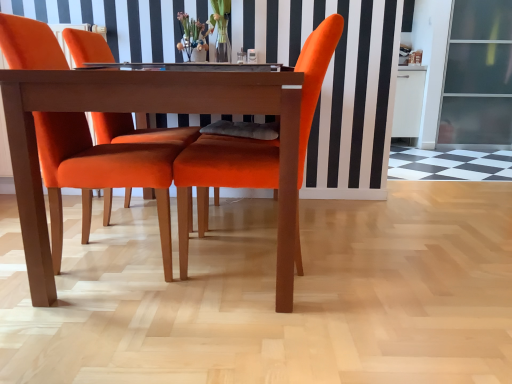
Question: Is translucent glass vase at center shorter than velvet orange chair at center, arranged as the second chair when viewed from the right?

Choices:
 (A) no
 (B) yes

Answer: (B)

Question: Considering the relative positions of translucent glass vase at center and velvet orange chair at center, arranged as the second chair when viewed from the right, in the image provided, is translucent glass vase at center to the right of velvet orange chair at center, arranged as the second chair when viewed from the right, from the viewer's perspective?

Choices:
 (A) no
 (B) yes

Answer: (B)

Question: Considering the relative sizes of translucent glass vase at center and velvet orange chair at center, arranged as the second chair when viewed from the right, in the image provided, is translucent glass vase at center taller than velvet orange chair at center, arranged as the second chair when viewed from the right,?

Choices:
 (A) yes
 (B) no

Answer: (B)

Question: Would you say translucent glass vase at center contains velvet orange chair at center, placed as the 1th chair when sorted from left to right?

Choices:
 (A) no
 (B) yes

Answer: (A)

Question: Can you confirm if translucent glass vase at center is wider than velvet orange chair at center, placed as the 1th chair when sorted from left to right?

Choices:
 (A) no
 (B) yes

Answer: (A)

Question: Does translucent glass vase at center have a smaller size compared to velvet orange chair at center, placed as the 1th chair when sorted from left to right?

Choices:
 (A) no
 (B) yes

Answer: (B)

Question: Is wooden table at center next to translucent glass vase at center and touching it?

Choices:
 (A) yes
 (B) no

Answer: (B)

Question: Is wooden table at center further to camera compared to translucent glass vase at center?

Choices:
 (A) no
 (B) yes

Answer: (A)

Question: Does wooden table at center turn towards translucent glass vase at center?

Choices:
 (A) yes
 (B) no

Answer: (B)

Question: Is wooden table at center located outside translucent glass vase at center?

Choices:
 (A) yes
 (B) no

Answer: (A)

Question: Does wooden table at center lie in front of translucent glass vase at center?

Choices:
 (A) yes
 (B) no

Answer: (A)

Question: Considering the relative sizes of wooden table at center and translucent glass vase at center in the image provided, is wooden table at center smaller than translucent glass vase at center?

Choices:
 (A) yes
 (B) no

Answer: (B)

Question: From a real-world perspective, is transparent glass screen door at right over translucent glass vase at center?

Choices:
 (A) yes
 (B) no

Answer: (B)